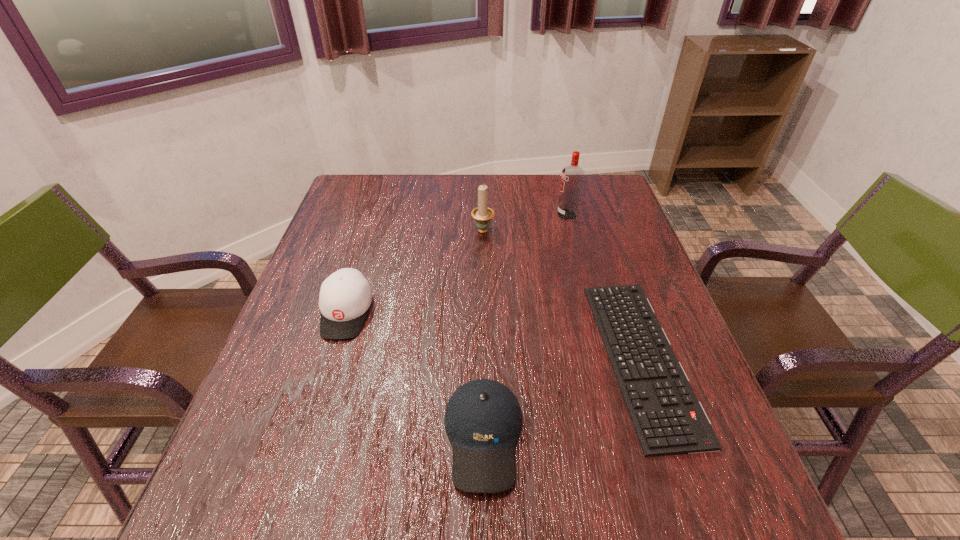
In order to click on blank region between the left baseball cap and the vodka in this screenshot , I will do `click(457, 264)`.

Image resolution: width=960 pixels, height=540 pixels. What are the coordinates of `free space between the farthest object and the leftmost object` in the screenshot? It's located at (457, 264).

The image size is (960, 540). I want to click on blank region between the farthest object and the fourth nearest object, so click(525, 222).

Locate an element on the screen. This screenshot has height=540, width=960. empty space between the farthest object and the leftmost object is located at coordinates (457, 264).

Locate an element on the screen. Image resolution: width=960 pixels, height=540 pixels. free space between the fourth nearest object and the leftmost object is located at coordinates (x=415, y=271).

Identify the location of vacant region between the computer keyboard and the leftmost object. (493, 335).

At what (x,y) coordinates should I click in order to perform the action: click on free space between the tallest object and the candle_holder. Please return your answer as a coordinate pair (x, y). Looking at the image, I should click on (525, 222).

Where is `free point between the candle_holder and the nearer baseball cap`? The height and width of the screenshot is (540, 960). free point between the candle_holder and the nearer baseball cap is located at coordinates (483, 333).

Identify the location of free space between the computer keyboard and the second farthest object. The height and width of the screenshot is (540, 960). (562, 294).

The width and height of the screenshot is (960, 540). I want to click on object that ranks as the second closest to the shortest object, so click(572, 177).